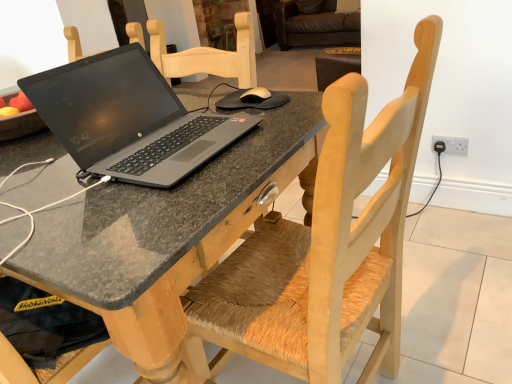
Question: Is point (345, 337) positioned closer to the camera than point (79, 134)?

Choices:
 (A) closer
 (B) farther

Answer: (A)

Question: Considering their positions, is wooden chair with woven seat at center located in front of or behind matte black laptop at center?

Choices:
 (A) front
 (B) behind

Answer: (A)

Question: Based on their relative distances, which object is farther from the matte black laptop at center?

Choices:
 (A) wooden chair with woven seat at center
 (B) white plastic electrical outlet at right
 (C) granite table at center

Answer: (B)

Question: Estimate the real-world distances between objects in this image. Which object is farther from the granite table at center?

Choices:
 (A) wooden chair with woven seat at center
 (B) matte black laptop at center
 (C) white plastic electrical outlet at right

Answer: (C)